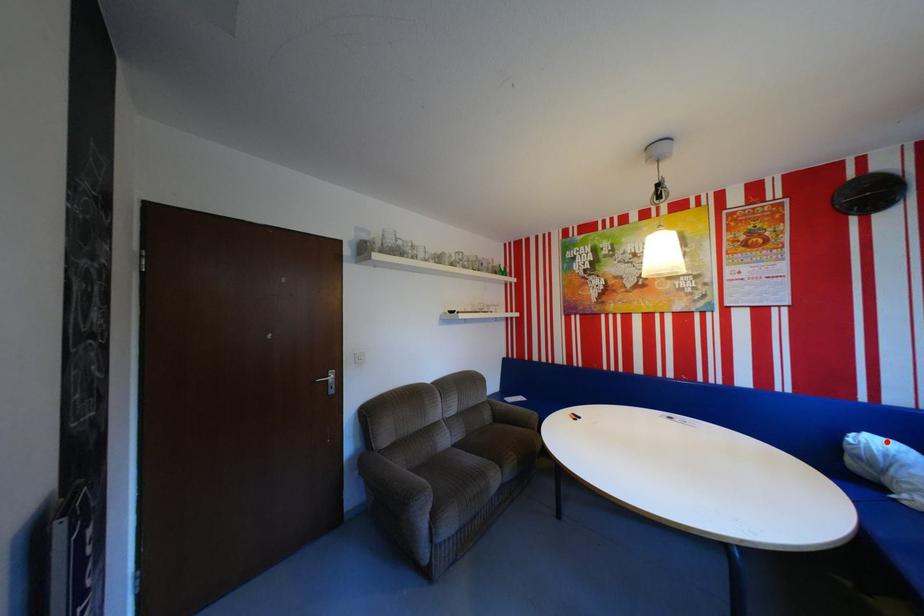
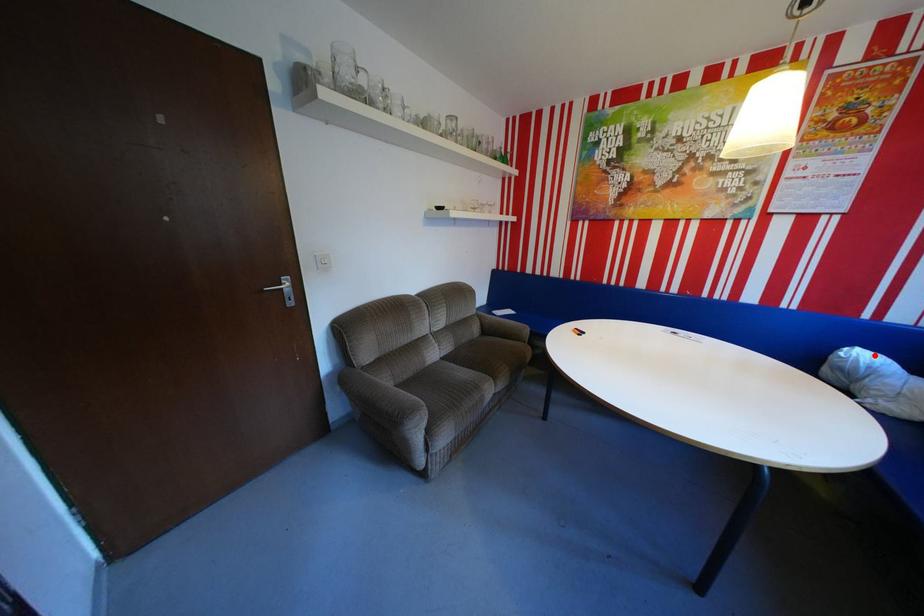
I am providing you with two images of the same scene from different viewpoints. A red point is marked on the first image and another point is marked on the second image. Are the points marked in image1 and image2 representing the same 3D position?

Yes